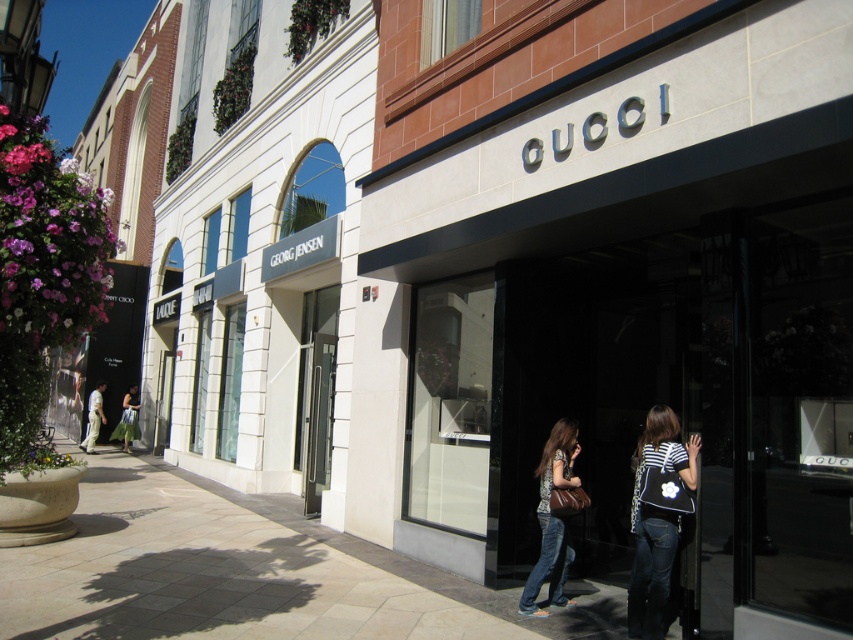
Question: Which point appears closest to the camera in this image?

Choices:
 (A) (695, 436)
 (B) (650, 593)
 (C) (552, 518)
 (D) (102, 634)

Answer: (D)

Question: Does light beige paving stone at lower center have a lesser width compared to denim jeans at center?

Choices:
 (A) yes
 (B) no

Answer: (B)

Question: Which object appears closest to the camera in this image?

Choices:
 (A) striped fabric backpack at center
 (B) jeans at lower center
 (C) denim jeans at center

Answer: (A)

Question: Observing the image, what is the correct spatial positioning of denim at lower right in reference to jeans at lower center?

Choices:
 (A) right
 (B) left

Answer: (A)

Question: Which point is farther to the camera?

Choices:
 (A) (314, 604)
 (B) (538, 477)
 (C) (653, 573)
 (D) (654, 573)

Answer: (B)

Question: Can you confirm if striped fabric backpack at center is wider than denim jeans at center?

Choices:
 (A) yes
 (B) no

Answer: (A)